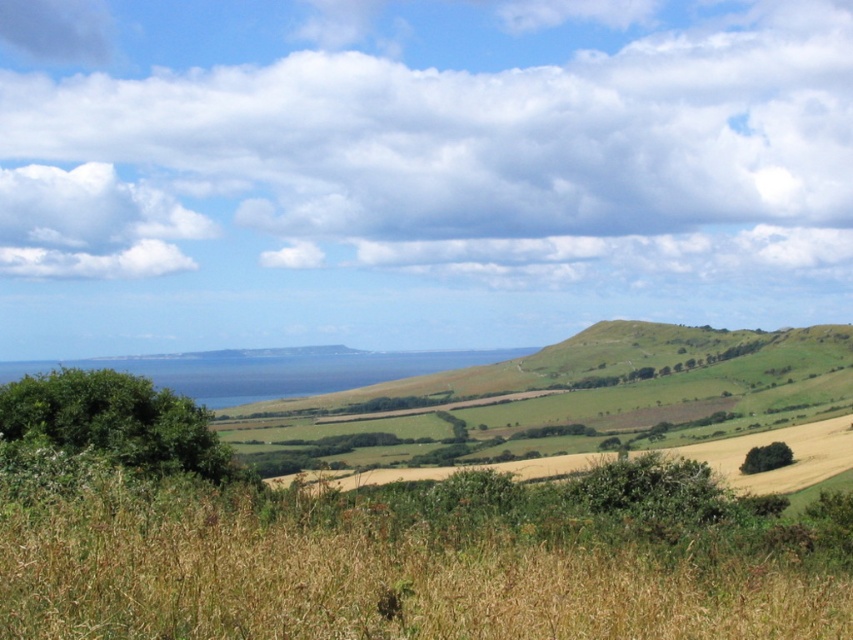
Does white fluffy cloud at upper center have a greater height compared to white fluffy cloud at upper left?

Yes, white fluffy cloud at upper center is taller than white fluffy cloud at upper left.

Describe the element at coordinates (451, 154) in the screenshot. This screenshot has width=853, height=640. I see `white fluffy cloud at upper center` at that location.

Where is `white fluffy cloud at upper center`? white fluffy cloud at upper center is located at coordinates (451, 154).